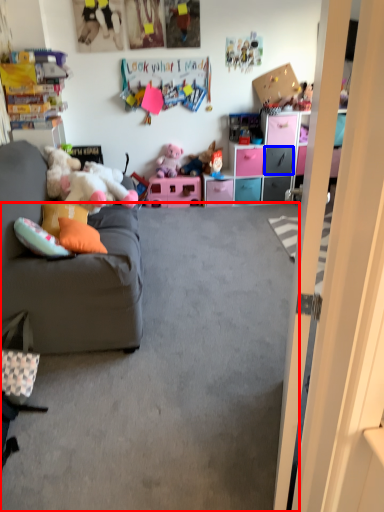
Question: Among these objects, which one is farthest to the camera, plain (highlighted by a red box) or drawer (highlighted by a blue box)?

Choices:
 (A) plain
 (B) drawer

Answer: (B)